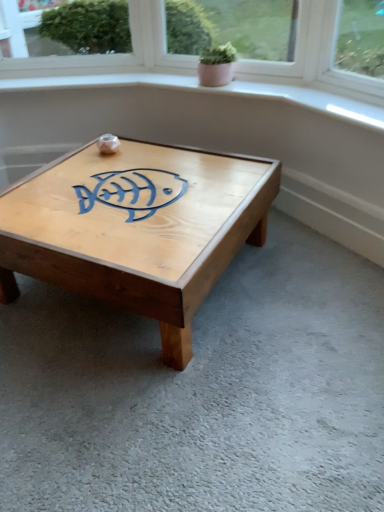
What is the approximate height of natural wood coffee table at center?

13.34 inches.

Where is `natural wood coffee table at center`? This screenshot has height=512, width=384. natural wood coffee table at center is located at coordinates click(x=136, y=228).

Describe the element at coordinates (136, 228) in the screenshot. The image size is (384, 512). I see `natural wood coffee table at center` at that location.

The image size is (384, 512). Describe the element at coordinates (217, 65) in the screenshot. I see `pink matte pot at upper center` at that location.

Identify the location of pink matte pot at upper center. This screenshot has height=512, width=384. (217, 65).

This screenshot has height=512, width=384. In order to click on natural wood coffee table at center in this screenshot , I will do `click(136, 228)`.

Would you say natural wood coffee table at center is to the left or to the right of pink matte pot at upper center in the picture?

Clearly, natural wood coffee table at center is on the left of pink matte pot at upper center in the image.

Is natural wood coffee table at center further to the viewer compared to pink matte pot at upper center?

No, the depth of natural wood coffee table at center is less than that of pink matte pot at upper center.

Considering the points (55, 256) and (208, 66), which point is behind, point (55, 256) or point (208, 66)?

Point (208, 66)

From the image's perspective, between natural wood coffee table at center and pink matte pot at upper center, which one is located above?

From the image's view, pink matte pot at upper center is above.

In the scene shown: From a real-world perspective, relative to pink matte pot at upper center, is natural wood coffee table at center vertically above or below?

From a real-world perspective, natural wood coffee table at center is physically below pink matte pot at upper center.

Considering the relative sizes of natural wood coffee table at center and pink matte pot at upper center in the image provided, is natural wood coffee table at center wider than pink matte pot at upper center?

Yes.

Does natural wood coffee table at center have a lesser height compared to pink matte pot at upper center?

No.

Between natural wood coffee table at center and pink matte pot at upper center, which one has larger size?

With larger size is natural wood coffee table at center.

Which is correct: natural wood coffee table at center is inside pink matte pot at upper center, or outside of it?

natural wood coffee table at center cannot be found inside pink matte pot at upper center.

Is natural wood coffee table at center touching pink matte pot at upper center?

No.

Is natural wood coffee table at center turned away from pink matte pot at upper center?

natural wood coffee table at center does not have its back to pink matte pot at upper center.

How different are the orientations of natural wood coffee table at center and pink matte pot at upper center in degrees?

They differ by 1.75 degrees in their facing directions.

At what (x,y) coordinates should I click in order to perform the action: click on houseplant located above the natural wood coffee table at center (from the image's perspective). Please return your answer as a coordinate pair (x, y). The image size is (384, 512). Looking at the image, I should click on [x=217, y=65].

Is pink matte pot at upper center to the left of natural wood coffee table at center from the viewer's perspective?

No.

In the image, is pink matte pot at upper center positioned in front of or behind natural wood coffee table at center?

pink matte pot at upper center is behind natural wood coffee table at center.

Which is further, (222, 62) or (16, 269)?

The point (222, 62) is farther.

From the image's perspective, is pink matte pot at upper center above or below natural wood coffee table at center?

Clearly, from the image's perspective, pink matte pot at upper center is above natural wood coffee table at center.

From a real-world perspective, is pink matte pot at upper center over natural wood coffee table at center?

Yes, from a real-world perspective, pink matte pot at upper center is over natural wood coffee table at center

Looking at their sizes, would you say pink matte pot at upper center is wider or thinner than natural wood coffee table at center?

Considering their sizes, pink matte pot at upper center looks slimmer than natural wood coffee table at center.

Is pink matte pot at upper center shorter than natural wood coffee table at center?

Indeed, pink matte pot at upper center has a lesser height compared to natural wood coffee table at center.

Does pink matte pot at upper center have a larger size compared to natural wood coffee table at center?

No.

Is pink matte pot at upper center completely or partially outside of natural wood coffee table at center?

Yes, pink matte pot at upper center is outside of natural wood coffee table at center.

Are pink matte pot at upper center and natural wood coffee table at center beside each other?

pink matte pot at upper center is not next to natural wood coffee table at center, and they're not touching.

Is pink matte pot at upper center oriented away from natural wood coffee table at center?

No, pink matte pot at upper center's orientation is not away from natural wood coffee table at center.

How different are the orientations of pink matte pot at upper center and natural wood coffee table at center in degrees?

The angular difference between pink matte pot at upper center and natural wood coffee table at center is 1.75 degrees.

Locate an element on the screen. This screenshot has height=512, width=384. coffee table in front of the pink matte pot at upper center is located at coordinates (136, 228).

At what (x,y) coordinates should I click in order to perform the action: click on houseplant that is above the natural wood coffee table at center (from the image's perspective). Please return your answer as a coordinate pair (x, y). The width and height of the screenshot is (384, 512). Looking at the image, I should click on (x=217, y=65).

This screenshot has width=384, height=512. In order to click on coffee table below the pink matte pot at upper center (from the image's perspective) in this screenshot , I will do `click(136, 228)`.